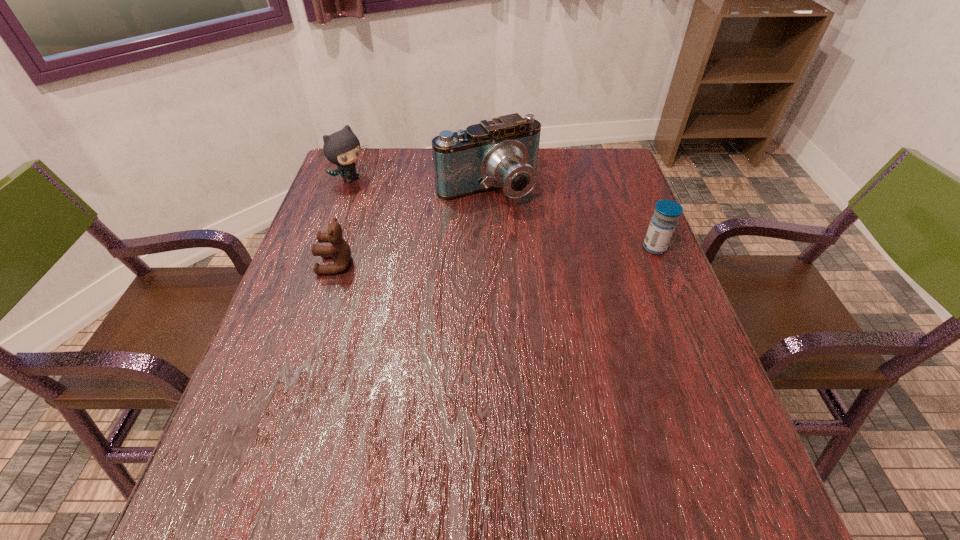
You are a GUI agent. You are given a task and a screenshot of the screen. Output one action in this format:
    pyautogui.click(x=<x>, y=<y>)
    Task: Click on the free location at the near edge
    
    Given the screenshot: What is the action you would take?
    pyautogui.click(x=513, y=416)

This screenshot has width=960, height=540. Identify the location of vacant area at the left edge of the desktop. (309, 336).

At what (x,y) coordinates should I click in order to perform the action: click on free spot at the right edge of the desktop. Please return your answer as a coordinate pair (x, y). This screenshot has height=540, width=960. Looking at the image, I should click on (638, 204).

Locate an element on the screen. This screenshot has width=960, height=540. vacant space at the far right corner of the desktop is located at coordinates (584, 183).

Where is `blank region between the rightmost object and the teddy bear`? This screenshot has width=960, height=540. blank region between the rightmost object and the teddy bear is located at coordinates (495, 256).

Locate an element on the screen. free area in between the teddy bear and the medicine is located at coordinates (495, 256).

The image size is (960, 540). What are the coordinates of `vacant space that is in between the teddy bear and the kitten` in the screenshot? It's located at (344, 222).

Identify the location of vacant point located between the third object from left to right and the kitten. The height and width of the screenshot is (540, 960). (420, 184).

At what (x,y) coordinates should I click in order to perform the action: click on free point between the kitten and the teddy bear. Please return your answer as a coordinate pair (x, y). This screenshot has width=960, height=540. Looking at the image, I should click on (344, 222).

What are the coordinates of `vacant point located between the kitten and the tallest object` in the screenshot? It's located at 420,184.